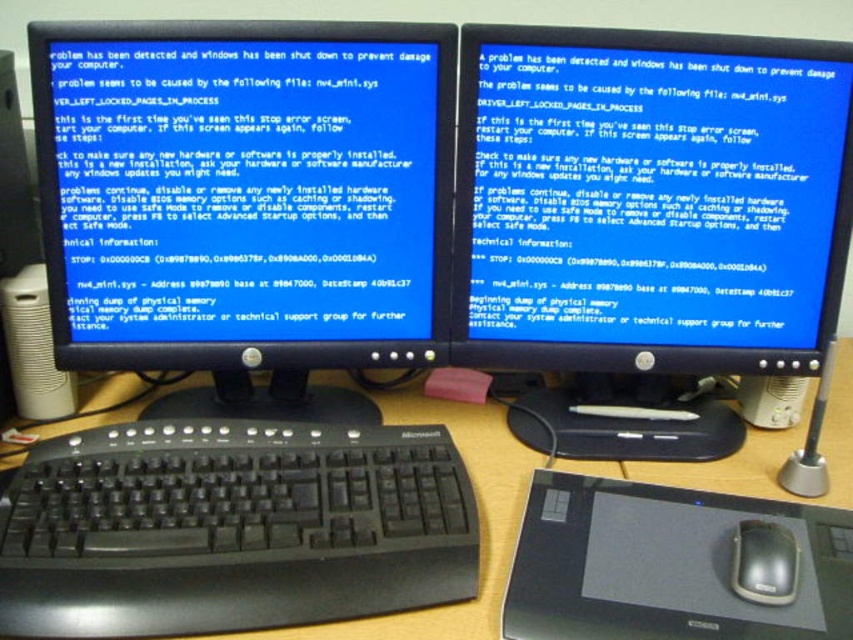
Can you confirm if black glossy monitor at center is shorter than wooden desk at center?

Incorrect, black glossy monitor at center's height does not fall short of wooden desk at center's.

Is point (390, 269) closer to camera compared to point (610, 474)?

Yes, it is in front of point (610, 474).

This screenshot has height=640, width=853. I want to click on black glossy monitor at center, so click(x=247, y=204).

From the picture: Is black glossy monitor at center to the right of black matte mouse at lower right from the viewer's perspective?

Incorrect, black glossy monitor at center is not on the right side of black matte mouse at lower right.

Does point (302, 340) lie in front of point (763, 566)?

No, (302, 340) is behind (763, 566).

Does point (358, 282) lie in front of point (746, 592)?

That is False.

Locate an element on the screen. black glossy monitor at center is located at coordinates (247, 204).

Between black plastic monitor at center and black plastic keyboard at lower left, which one is positioned lower?

black plastic keyboard at lower left is below.

Which is more to the right, black plastic monitor at center or black plastic keyboard at lower left?

black plastic monitor at center is more to the right.

Who is more distant from viewer, (785,364) or (90,589)?

Point (785,364)

Locate an element on the screen. black plastic monitor at center is located at coordinates (648, 220).